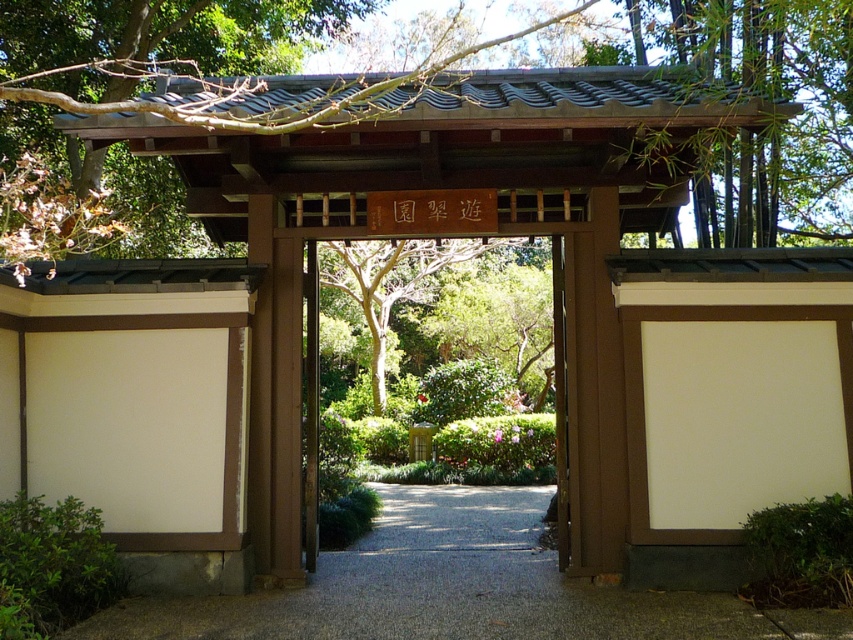
Is smooth gravel path at center positioned behind brown wooden gate at upper center?

No, it is in front of brown wooden gate at upper center.

Which is behind, point (340, 621) or point (753, 70)?

Point (753, 70)

Describe the element at coordinates (454, 588) in the screenshot. I see `smooth gravel path at center` at that location.

Where is `smooth gravel path at center`? smooth gravel path at center is located at coordinates (454, 588).